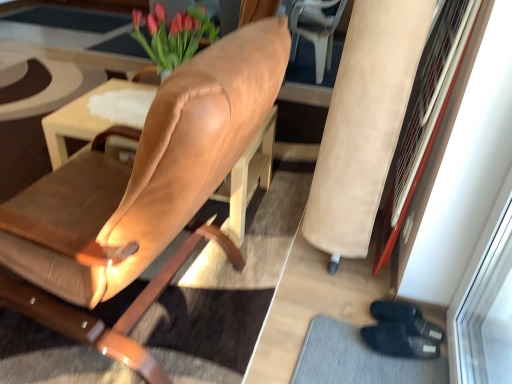
The width and height of the screenshot is (512, 384). Identify the location of free region under black fabric doormat at lower right (from a real-world perspective). (369, 358).